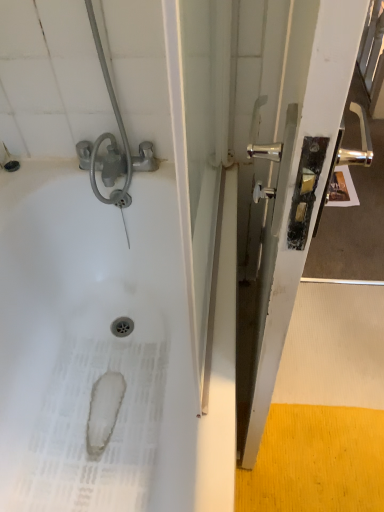
Question: Should I look upward or downward to see white glossy bathtub at upper left?

Choices:
 (A) down
 (B) up

Answer: (A)

Question: From the image's perspective, does white glossy bathtub at upper left appear higher than metallic silver handle at right?

Choices:
 (A) no
 (B) yes

Answer: (A)

Question: Is white glossy bathtub at upper left not near metallic silver handle at right?

Choices:
 (A) no
 (B) yes

Answer: (A)

Question: From a real-world perspective, is white glossy bathtub at upper left located higher than metallic silver handle at right?

Choices:
 (A) yes
 (B) no

Answer: (B)

Question: Considering the relative positions of white glossy bathtub at upper left and metallic silver handle at right in the image provided, is white glossy bathtub at upper left to the right of metallic silver handle at right from the viewer's perspective?

Choices:
 (A) no
 (B) yes

Answer: (A)

Question: Is white glossy bathtub at upper left next to metallic silver handle at right and touching it?

Choices:
 (A) yes
 (B) no

Answer: (B)

Question: Is white glossy bathtub at upper left in front of metallic silver handle at right?

Choices:
 (A) yes
 (B) no

Answer: (B)

Question: From a real-world perspective, is metallic silver handle at right positioned over white glossy bathtub at upper left based on gravity?

Choices:
 (A) yes
 (B) no

Answer: (A)

Question: Is metallic silver handle at right positioned beyond the bounds of white glossy bathtub at upper left?

Choices:
 (A) yes
 (B) no

Answer: (A)

Question: Can you confirm if metallic silver handle at right is smaller than white glossy bathtub at upper left?

Choices:
 (A) no
 (B) yes

Answer: (B)

Question: Is metallic silver handle at right wider than white glossy bathtub at upper left?

Choices:
 (A) no
 (B) yes

Answer: (A)

Question: Is metallic silver handle at right to the left of white glossy bathtub at upper left from the viewer's perspective?

Choices:
 (A) no
 (B) yes

Answer: (A)

Question: Does metallic silver handle at right turn towards white glossy bathtub at upper left?

Choices:
 (A) yes
 (B) no

Answer: (A)

Question: Considering the positions of metallic silver handle at right and white glossy bathtub at upper left in the image, is metallic silver handle at right wider or thinner than white glossy bathtub at upper left?

Choices:
 (A) wide
 (B) thin

Answer: (B)